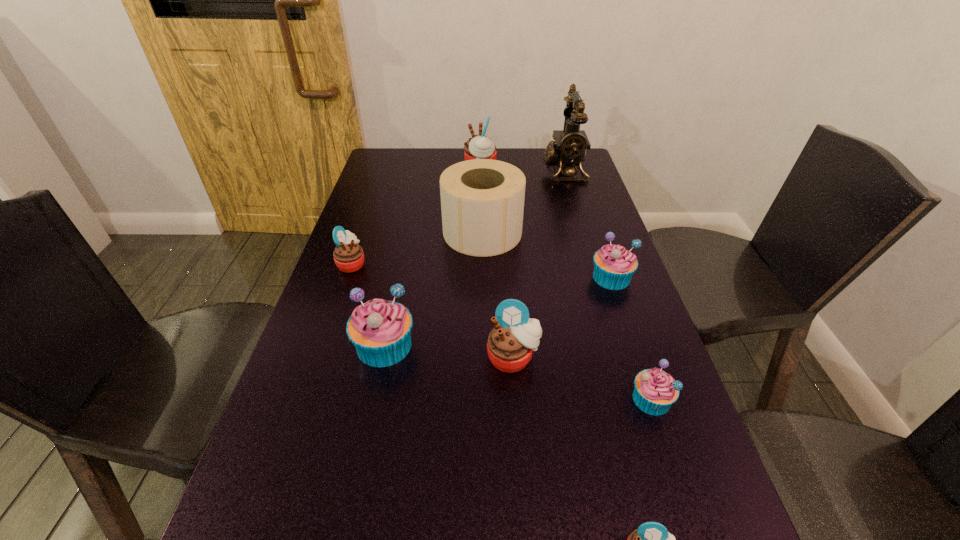
Identify which muffin is the closest to the toilet tissue. Please provide its 2D coordinates. Your answer should be formatted as a tuple, i.e. [(x, y)], where the tuple contains the x and y coordinates of a point satisfying the conditions above.

[(614, 265)]

This screenshot has width=960, height=540. I want to click on muffin that can be found as the closest to the nearest blue muffin, so click(x=510, y=345).

Where is `pink muffin that is the second nearest to the nearest blue muffin`? The height and width of the screenshot is (540, 960). pink muffin that is the second nearest to the nearest blue muffin is located at coordinates (651, 539).

Point out which pink muffin is positioned as the third nearest to the telephone. Please provide its 2D coordinates. Your answer should be formatted as a tuple, i.e. [(x, y)], where the tuple contains the x and y coordinates of a point satisfying the conditions above.

[(510, 345)]

Locate an element on the screen. This screenshot has height=540, width=960. blue muffin that is the second closest to the toilet tissue is located at coordinates (380, 330).

Locate an element on the screen. This screenshot has width=960, height=540. the closest blue muffin to the farthest blue muffin is located at coordinates 655,391.

You are a GUI agent. You are given a task and a screenshot of the screen. Output one action in this format:
    pyautogui.click(x=<x>, y=<y>)
    Task: Click on the free point that satisfies the following two spatial constraints: 1. on the front-facing side of the sixth muffin from right to left; 2. on the right side of the leftmost pink muffin
    Image resolution: width=960 pixels, height=540 pixels.
    Given the screenshot: What is the action you would take?
    pyautogui.click(x=324, y=346)

At what (x,y) coordinates should I click in order to perform the action: click on vacant region that satisfies the following two spatial constraints: 1. on the rotary dial of the telephone; 2. on the front side of the toilet tissue. Please return your answer as a coordinate pair (x, y). The height and width of the screenshot is (540, 960). Looking at the image, I should click on (582, 232).

Locate an element on the screen. free spot that satisfies the following two spatial constraints: 1. on the front-facing side of the leftmost muffin; 2. on the right side of the second biggest blue muffin is located at coordinates (347, 278).

What are the coordinates of `vacant space that satisfies the following two spatial constraints: 1. on the rotary dial of the telephone; 2. on the back side of the nearest blue muffin` in the screenshot? It's located at (633, 400).